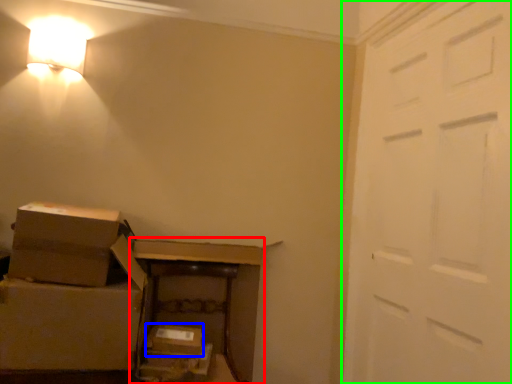
Question: Which is farther away from furniture (highlighted by a red box)? storage box (highlighted by a blue box) or door (highlighted by a green box)?

Choices:
 (A) storage box
 (B) door

Answer: (B)